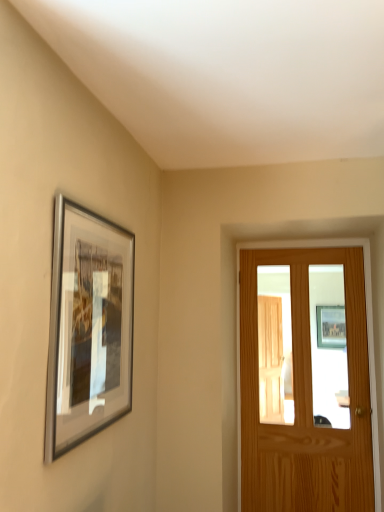
Question: Can you confirm if silver metallic picture frame at upper left is smaller than light brown wooden door at right?

Choices:
 (A) no
 (B) yes

Answer: (B)

Question: Does silver metallic picture frame at upper left contain light brown wooden door at right?

Choices:
 (A) no
 (B) yes

Answer: (A)

Question: Is silver metallic picture frame at upper left wider than light brown wooden door at right?

Choices:
 (A) no
 (B) yes

Answer: (A)

Question: Is there a large distance between silver metallic picture frame at upper left and light brown wooden door at right?

Choices:
 (A) no
 (B) yes

Answer: (B)

Question: Is silver metallic picture frame at upper left bigger than light brown wooden door at right?

Choices:
 (A) no
 (B) yes

Answer: (A)

Question: Considering the relative positions of silver metallic picture frame at upper left and light brown wooden door at right in the image provided, is silver metallic picture frame at upper left to the left of light brown wooden door at right from the viewer's perspective?

Choices:
 (A) no
 (B) yes

Answer: (B)

Question: Is light brown wooden door at right to the right of silver metallic picture frame at upper left from the viewer's perspective?

Choices:
 (A) yes
 (B) no

Answer: (A)

Question: Is light brown wooden door at right positioned beyond the bounds of silver metallic picture frame at upper left?

Choices:
 (A) yes
 (B) no

Answer: (A)

Question: Can you confirm if light brown wooden door at right is bigger than silver metallic picture frame at upper left?

Choices:
 (A) no
 (B) yes

Answer: (B)

Question: From a real-world perspective, is light brown wooden door at right below silver metallic picture frame at upper left?

Choices:
 (A) yes
 (B) no

Answer: (A)

Question: Is light brown wooden door at right in contact with silver metallic picture frame at upper left?

Choices:
 (A) yes
 (B) no

Answer: (B)

Question: Is the depth of light brown wooden door at right less than that of silver metallic picture frame at upper left?

Choices:
 (A) yes
 (B) no

Answer: (B)

Question: From the image's perspective, is light brown wooden door at right above or below silver metallic picture frame at upper left?

Choices:
 (A) above
 (B) below

Answer: (B)